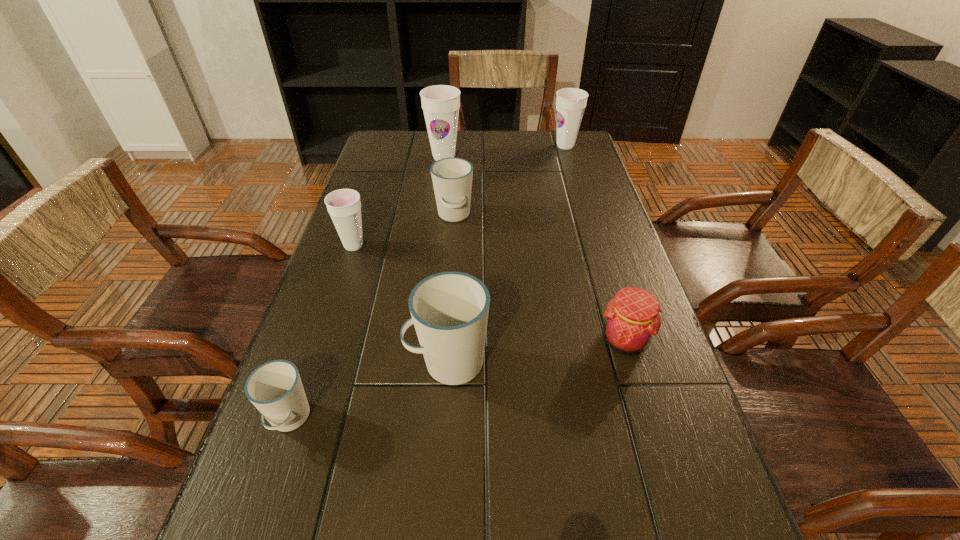
Where is `blank region between the nearest object and the second nearest cup`? Image resolution: width=960 pixels, height=540 pixels. blank region between the nearest object and the second nearest cup is located at coordinates (369, 391).

Locate an element on the screen. free space between the jam and the second smallest white cup is located at coordinates (540, 278).

Find the location of a particular element. This screenshot has height=540, width=960. vacant space in between the tallest cup and the rightmost purple cup is located at coordinates (505, 152).

Find the location of a particular element. Image resolution: width=960 pixels, height=540 pixels. vacant area between the fourth nearest object and the second nearest cup is located at coordinates (400, 304).

Select which object is the fourth closest to the second farthest white cup. Please provide its 2D coordinates. Your answer should be formatted as a tuple, i.e. [(x, y)], where the tuple contains the x and y coordinates of a point satisfying the conditions above.

[(452, 177)]

The width and height of the screenshot is (960, 540). I want to click on object that is the fifth closest to the fifth nearest object, so [x=632, y=319].

Identify which cup is located as the third nearest to the second smallest purple cup. Please provide its 2D coordinates. Your answer should be formatted as a tuple, i.e. [(x, y)], where the tuple contains the x and y coordinates of a point satisfying the conditions above.

[(344, 206)]

Point out which cup is positioned as the fourth nearest to the tallest object. Please provide its 2D coordinates. Your answer should be formatted as a tuple, i.e. [(x, y)], where the tuple contains the x and y coordinates of a point satisfying the conditions above.

[(449, 310)]

Locate an element on the screen. The width and height of the screenshot is (960, 540). purple cup that stands as the second closest to the smallest white cup is located at coordinates (440, 103).

Where is `the closest purple cup to the jam`? Image resolution: width=960 pixels, height=540 pixels. the closest purple cup to the jam is located at coordinates (344, 206).